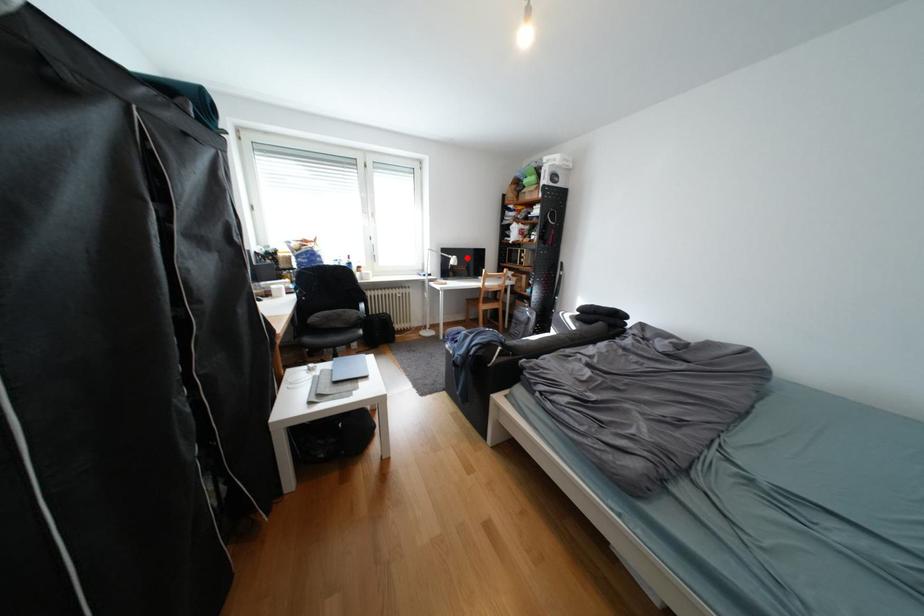
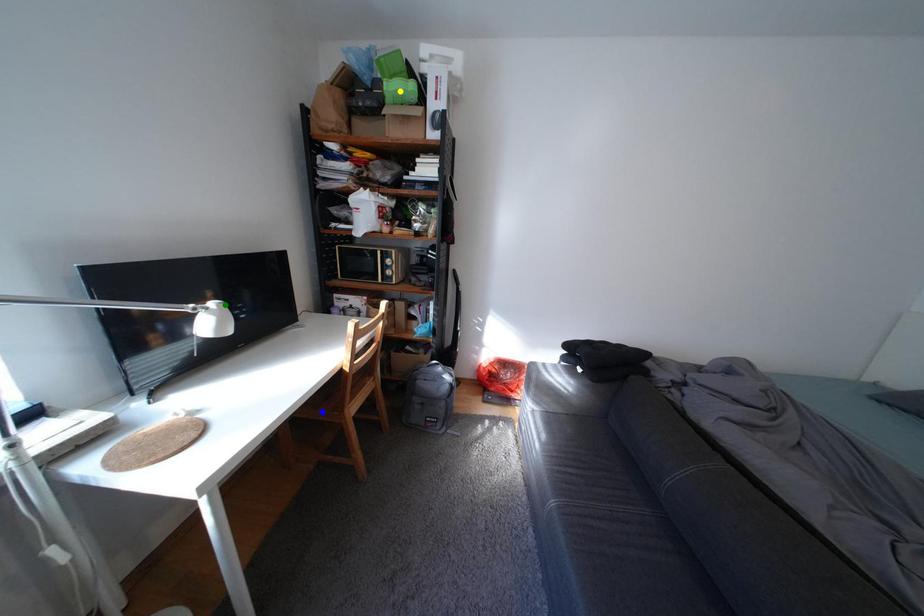
Question: I am providing you with two images of the same scene from different viewpoints. A red point is marked on the first image. You are given multiple points on the second image. Which mark in image 2 goes with the point in image 1?

Choices:
 (A) blue point
 (B) yellow point
 (C) green point

Answer: (C)